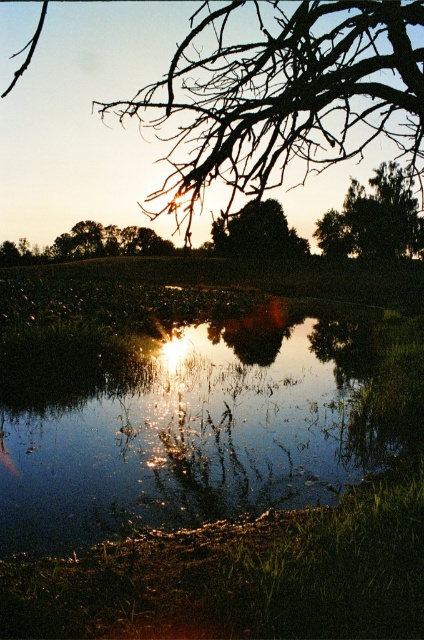
Question: Is brown/dry wood branches at upper center positioned in front of green matte tree at center?

Choices:
 (A) yes
 (B) no

Answer: (A)

Question: Among these points, which one is nearest to the camera?

Choices:
 (A) (423, 236)
 (B) (284, 410)
 (C) (326, 35)

Answer: (C)

Question: Among these objects, which one is nearest to the camera?

Choices:
 (A) reflective glass water at center
 (B) green matte tree at center
 (C) green matte tree at upper right

Answer: (A)

Question: Among these objects, which one is nearest to the camera?

Choices:
 (A) green matte tree at center
 (B) brown/dry wood branches at upper center
 (C) reflective glass water at center
 (D) green matte tree at upper right

Answer: (B)

Question: Is green matte tree at upper right to the left of green matte tree at center from the viewer's perspective?

Choices:
 (A) no
 (B) yes

Answer: (A)

Question: Observing the image, what is the correct spatial positioning of green matte tree at upper right in reference to green matte tree at center?

Choices:
 (A) above
 (B) below

Answer: (A)